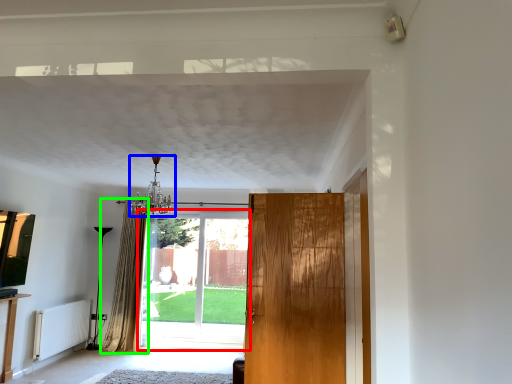
Question: Which object is the closest to the door (highlighted by a red box)? Choose among these: light fixture (highlighted by a blue box) or curtain (highlighted by a green box).

Choices:
 (A) light fixture
 (B) curtain

Answer: (B)